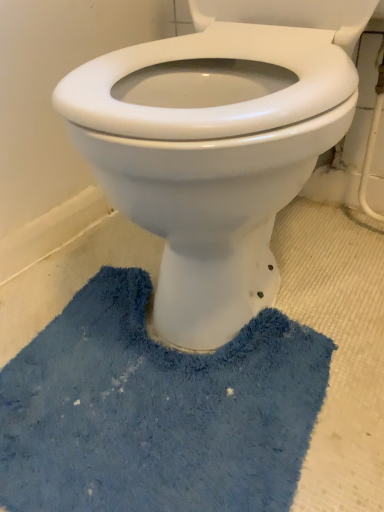
Question: Is point (61, 438) positioned closer to the camera than point (258, 39)?

Choices:
 (A) farther
 (B) closer

Answer: (B)

Question: In terms of size, does blue fuzzy bath mat at lower center appear bigger or smaller than white glossy toilet at center?

Choices:
 (A) big
 (B) small

Answer: (B)

Question: Looking at their shapes, would you say blue fuzzy bath mat at lower center is wider or thinner than white glossy toilet at center?

Choices:
 (A) thin
 (B) wide

Answer: (A)

Question: Is white glossy toilet at center wider or thinner than blue fuzzy bath mat at lower center?

Choices:
 (A) thin
 (B) wide

Answer: (B)

Question: Is point (187, 223) closer or farther from the camera than point (311, 415)?

Choices:
 (A) closer
 (B) farther

Answer: (A)

Question: In the image, is white glossy toilet at center positioned in front of or behind blue fuzzy bath mat at lower center?

Choices:
 (A) front
 (B) behind

Answer: (A)

Question: Considering the relative positions of white glossy toilet at center and blue fuzzy bath mat at lower center in the image provided, is white glossy toilet at center to the left or to the right of blue fuzzy bath mat at lower center?

Choices:
 (A) right
 (B) left

Answer: (A)